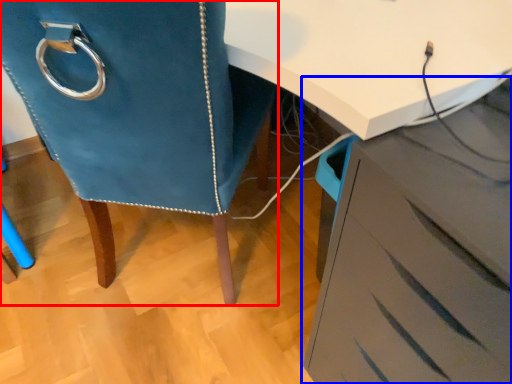
Question: Which object is closer to the camera taking this photo, furniture (highlighted by a red box) or chest of drawers (highlighted by a blue box)?

Choices:
 (A) furniture
 (B) chest of drawers

Answer: (B)